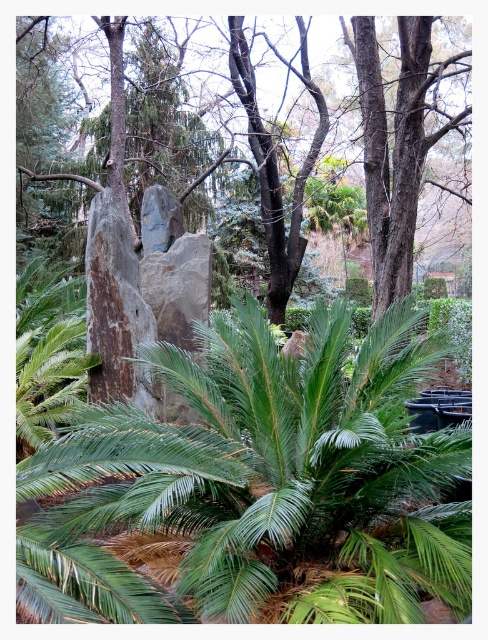
Is green leafy palm at center closer to the viewer compared to rough bark tree at center?

Yes, green leafy palm at center is in front of rough bark tree at center.

Locate an element on the screen. The width and height of the screenshot is (488, 640). green leafy palm at center is located at coordinates (259, 483).

At what (x,y) coordinates should I click in order to perform the action: click on green leafy palm at center. Please return your answer as a coordinate pair (x, y). This screenshot has width=488, height=640. Looking at the image, I should click on (259, 483).